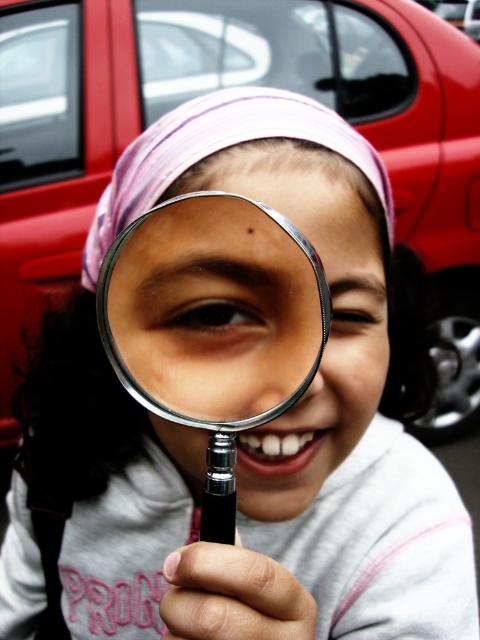
Consider the image. Who is more distant from viewer, (x=180, y=253) or (x=140, y=211)?

The point (x=140, y=211) is more distant.

Does point (244, 368) lie behind point (196, 122)?

No, it is not.

The width and height of the screenshot is (480, 640). In order to click on metallic silver magnifying glass at center in this screenshot , I will do `click(213, 310)`.

Based on the photo, which of these two, metallic red car at upper center or purple fabric headscarf at center, stands shorter?

Standing shorter between the two is purple fabric headscarf at center.

Which is in front, point (31, 310) or point (115, 208)?

Point (115, 208) is more forward.

Is point (19, 70) farther from viewer compared to point (224, 125)?

That is True.

Locate an element on the screen. The width and height of the screenshot is (480, 640). metallic red car at upper center is located at coordinates (224, 88).

This screenshot has width=480, height=640. In order to click on metallic red car at upper center in this screenshot , I will do `click(224, 88)`.

In the scene shown: Which of these two, metallic red car at upper center or metallic silver magnifying glass at center, stands taller?

metallic red car at upper center is taller.

What do you see at coordinates (224, 88) in the screenshot? I see `metallic red car at upper center` at bounding box center [224, 88].

This screenshot has height=640, width=480. In order to click on metallic red car at upper center in this screenshot , I will do 224,88.